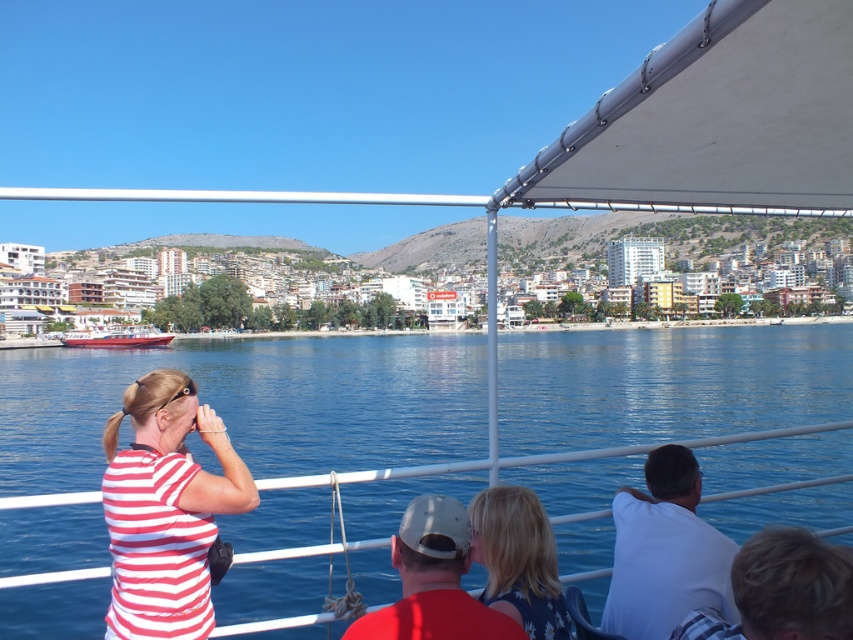
In the scene shown: You are a photographer on the boat and want to take a photo of the blonde hair at lower right without the white fabric canopy at upper right blocking the view. Is this possible?

The blonde hair at lower right is behind the white fabric canopy at upper right, so the canopy would block the view. To capture the blonde hair without obstruction, you would need to adjust your position or angle to move the canopy out of the frame.

You are a passenger on the boat and want to know which object in the scene is taller between the blue water at center and the dark blue fabric at lower center. Can you tell me which one is taller?

The blue water at center has a greater height compared to the dark blue fabric at lower center, so the blue water at center is taller.